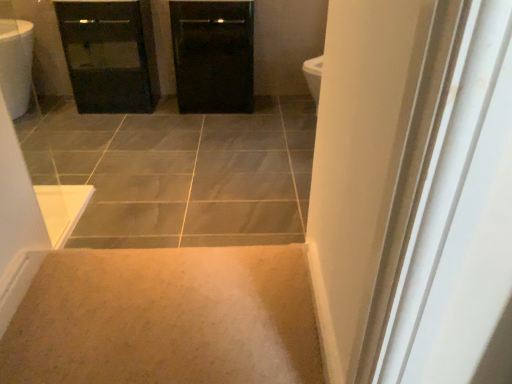
Question: Considering the relative sizes of black glossy cabinet at upper left and black glossy cabinet at center in the image provided, is black glossy cabinet at upper left smaller than black glossy cabinet at center?

Choices:
 (A) yes
 (B) no

Answer: (B)

Question: Is black glossy cabinet at upper left aimed at black glossy cabinet at center?

Choices:
 (A) no
 (B) yes

Answer: (A)

Question: Is black glossy cabinet at upper left further to camera compared to black glossy cabinet at center?

Choices:
 (A) no
 (B) yes

Answer: (A)

Question: Is black glossy cabinet at center a part of black glossy cabinet at upper left?

Choices:
 (A) no
 (B) yes

Answer: (A)

Question: From the image's perspective, is black glossy cabinet at upper left located above black glossy cabinet at center?

Choices:
 (A) yes
 (B) no

Answer: (B)

Question: From the image's perspective, is black glossy cabinet at upper left under black glossy cabinet at center?

Choices:
 (A) yes
 (B) no

Answer: (A)

Question: Considering the relative sizes of black glossy cabinet at upper left and beige carpet at lower center in the image provided, is black glossy cabinet at upper left taller than beige carpet at lower center?

Choices:
 (A) yes
 (B) no

Answer: (A)

Question: Can you confirm if black glossy cabinet at upper left is positioned to the left of beige carpet at lower center?

Choices:
 (A) yes
 (B) no

Answer: (A)

Question: Are black glossy cabinet at upper left and beige carpet at lower center far apart?

Choices:
 (A) no
 (B) yes

Answer: (B)

Question: From the image's perspective, is black glossy cabinet at upper left below beige carpet at lower center?

Choices:
 (A) no
 (B) yes

Answer: (A)

Question: From a real-world perspective, is black glossy cabinet at upper left physically above beige carpet at lower center?

Choices:
 (A) yes
 (B) no

Answer: (A)

Question: Does black glossy cabinet at upper left turn towards beige carpet at lower center?

Choices:
 (A) no
 (B) yes

Answer: (B)

Question: From a real-world perspective, does black glossy cabinet at center stand above black glossy cabinet at upper left?

Choices:
 (A) no
 (B) yes

Answer: (B)